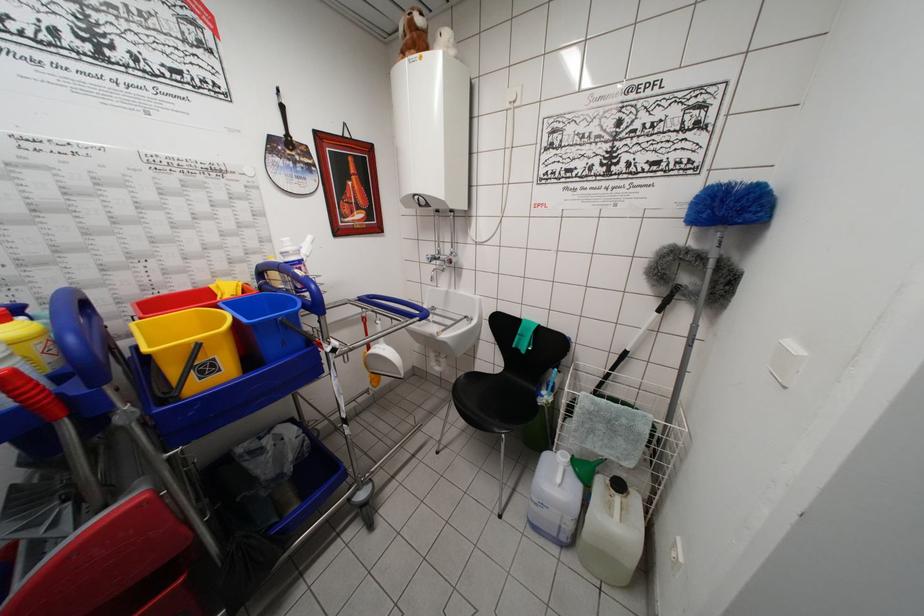
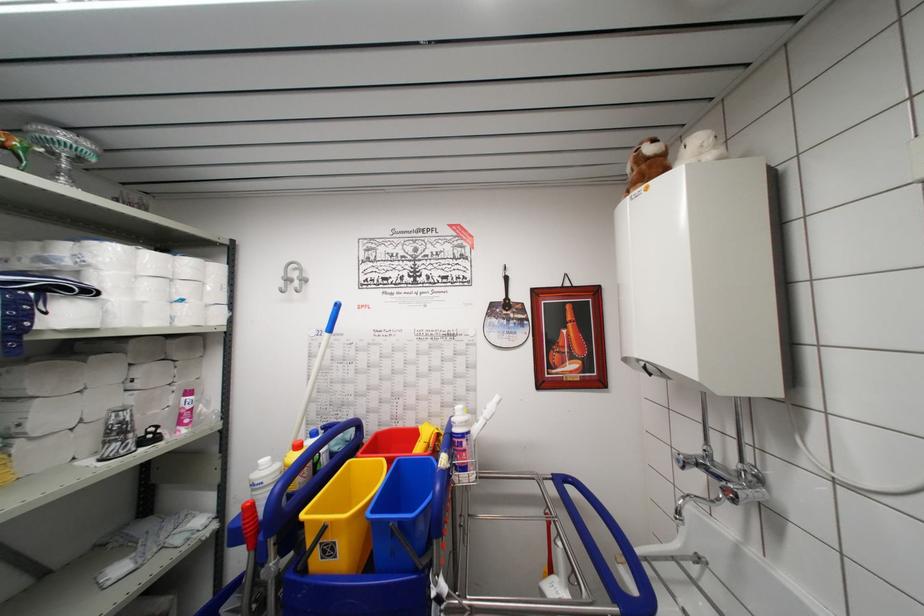
The point at (245, 288) is marked in the first image. Where is the corresponding point in the second image?

(439, 436)